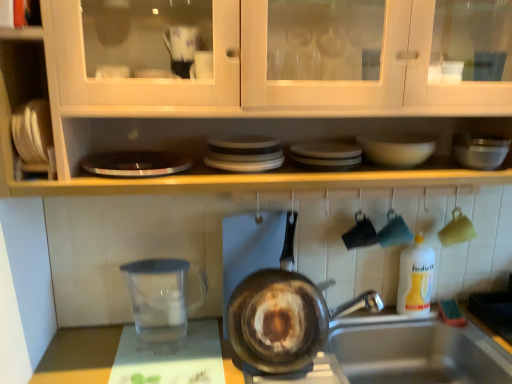
Locate an element on the screen. vacant area in front of transparent plastic measuring cup at lower left is located at coordinates (152, 372).